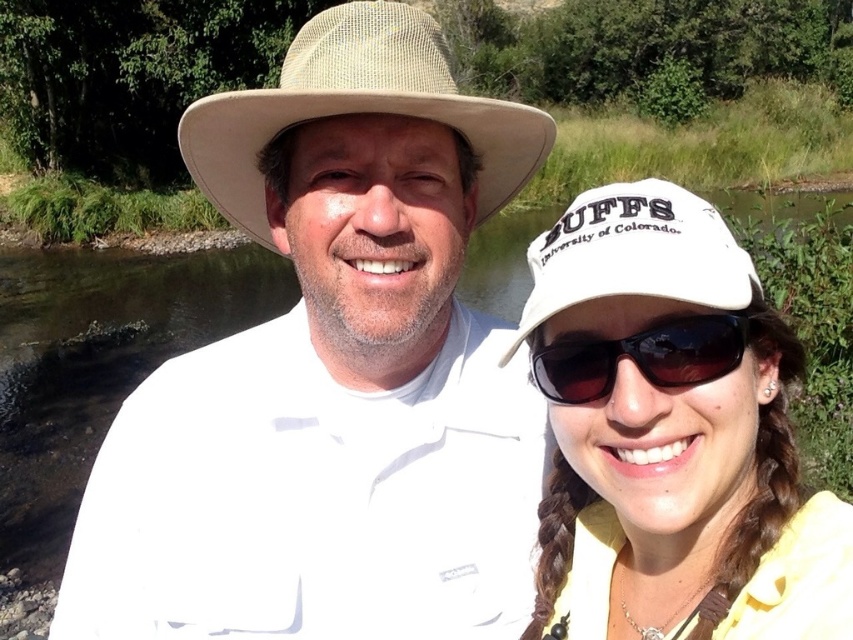
Question: Is clear water at creek center thinner than beige straw cowboy hat at upper center?

Choices:
 (A) yes
 (B) no

Answer: (B)

Question: Among these objects, which one is farthest from the camera?

Choices:
 (A) white fabric baseball cap at center
 (B) white fabric cap at upper right

Answer: (A)

Question: Which point is farther to the camera?

Choices:
 (A) white woven hat at upper center
 (B) white fabric cap at upper right
 (C) beige straw cowboy hat at upper center
 (D) black reflective sunglasses at center

Answer: (C)

Question: Which object is positioned closest to the beige straw cowboy hat at upper center?

Choices:
 (A) white fabric baseball cap at center
 (B) white fabric cap at upper right
 (C) black reflective sunglasses at center

Answer: (C)

Question: Considering the relative positions of white woven hat at upper center and clear water at creek center in the image provided, where is white woven hat at upper center located with respect to clear water at creek center?

Choices:
 (A) above
 (B) below

Answer: (B)

Question: Is white fabric cap at upper right below beige straw cowboy hat at upper center?

Choices:
 (A) yes
 (B) no

Answer: (A)